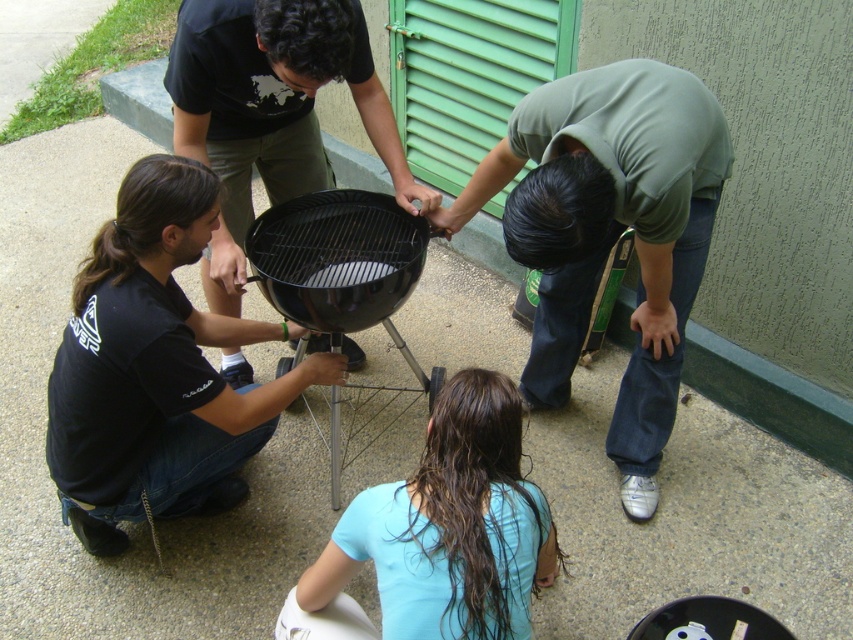
Is the position of matte black grill at center less distant than that of black matte barbecue grill at center?

Yes, it is.

Between matte black grill at center and black matte barbecue grill at center, which one is positioned higher?

matte black grill at center

The height and width of the screenshot is (640, 853). What are the coordinates of `matte black grill at center` in the screenshot? It's located at (271, 112).

Is matte black grill at center smaller than light blue fabric at lower center?

Actually, matte black grill at center might be larger than light blue fabric at lower center.

Is matte black grill at center below light blue fabric at lower center?

Actually, matte black grill at center is above light blue fabric at lower center.

Is point (221, 136) farther from viewer compared to point (383, 528)?

Yes, point (221, 136) is behind point (383, 528).

Locate an element on the screen. The image size is (853, 640). matte black grill at center is located at coordinates (271, 112).

The width and height of the screenshot is (853, 640). Describe the element at coordinates (450, 525) in the screenshot. I see `light blue fabric at lower center` at that location.

Looking at this image, is the position of light blue fabric at lower center more distant than that of black matte barbecue grill at center?

No, it is not.

Is point (363, 541) closer to viewer compared to point (314, 243)?

Yes, it is.

The width and height of the screenshot is (853, 640). I want to click on light blue fabric at lower center, so click(x=450, y=525).